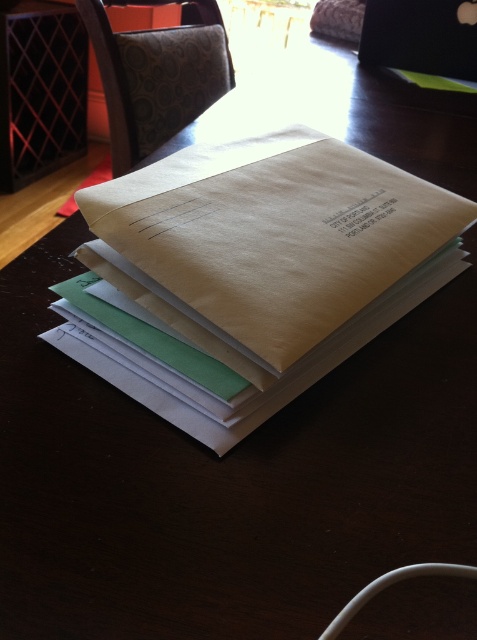
Can you confirm if matte paper envelope at center is positioned to the right of black glossy laptop at upper right?

No, matte paper envelope at center is not to the right of black glossy laptop at upper right.

Which is more to the right, matte paper envelope at center or black glossy laptop at upper right?

black glossy laptop at upper right

Is point (311, 173) farther from viewer compared to point (469, 4)?

No, (311, 173) is closer to viewer.

Locate an element on the screen. The height and width of the screenshot is (640, 477). matte paper envelope at center is located at coordinates (265, 241).

Can you confirm if brown paper book at center is taller than black glossy laptop at upper right?

In fact, brown paper book at center may be shorter than black glossy laptop at upper right.

Is brown paper book at center thinner than black glossy laptop at upper right?

No.

Find the location of a particular element. This screenshot has height=640, width=477. brown paper book at center is located at coordinates (252, 387).

Which is behind, point (232, 296) or point (143, 378)?

The point (143, 378) is behind.

Is matte paper envelope at center to the right of brown paper book at center from the viewer's perspective?

In fact, matte paper envelope at center is to the left of brown paper book at center.

What do you see at coordinates (265, 241) in the screenshot? I see `matte paper envelope at center` at bounding box center [265, 241].

I want to click on matte paper envelope at center, so coord(265,241).